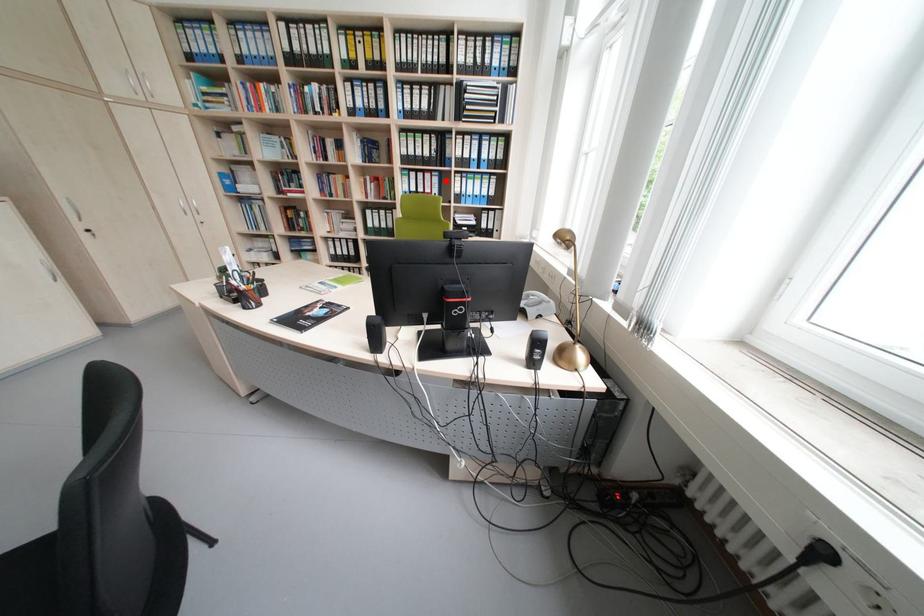
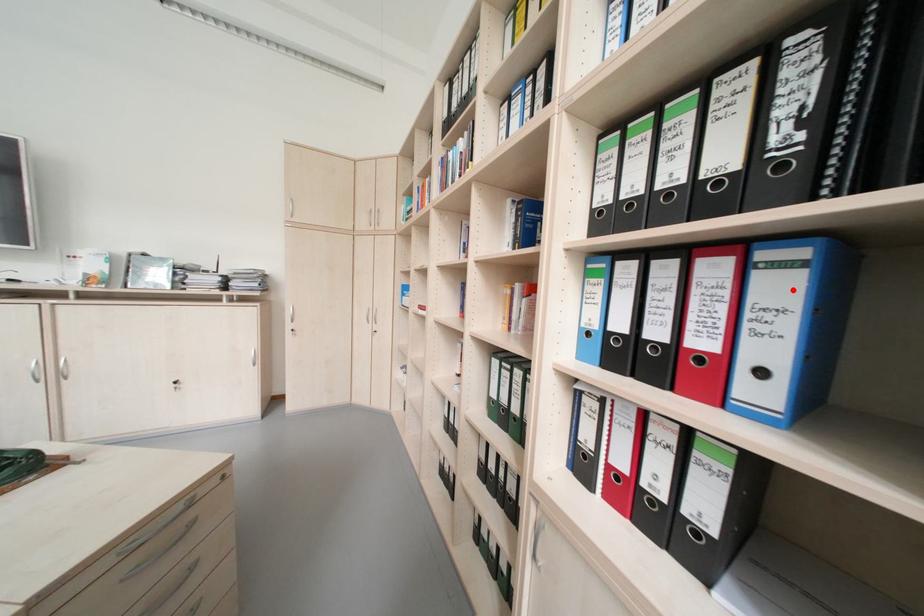
In the scene shown: I am providing you with two images of the same scene from different viewpoints. A red point is marked on the first image and another point is marked on the second image. Are the points marked in image1 and image2 representing the same 3D position?

Yes